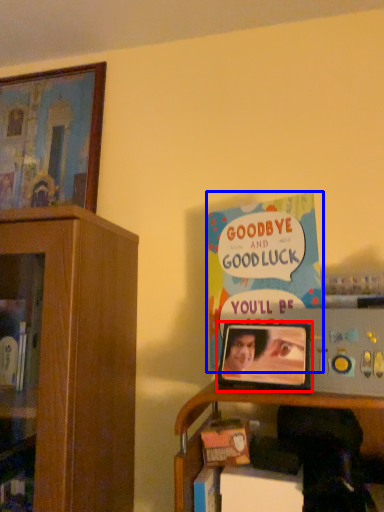
Question: Among these objects, which one is farthest to the camera, picture frame (highlighted by a red box) or book (highlighted by a blue box)?

Choices:
 (A) picture frame
 (B) book

Answer: (B)